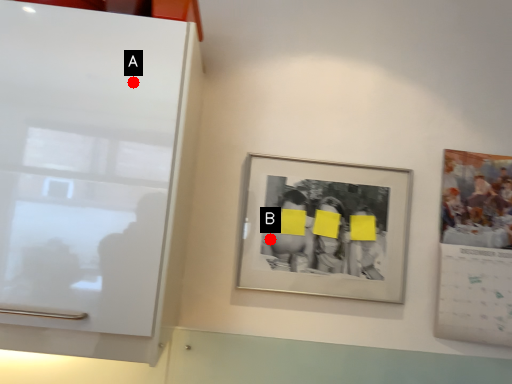
Question: Two points are circled on the image, labeled by A and B beside each circle. Which point is closer to the camera taking this photo?

Choices:
 (A) A is closer
 (B) B is closer

Answer: (A)